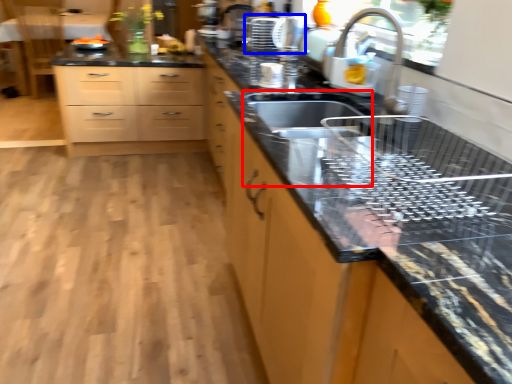
Question: Which object appears closest to the camera in this image, sink (highlighted by a red box) or appliance (highlighted by a blue box)?

Choices:
 (A) sink
 (B) appliance

Answer: (A)